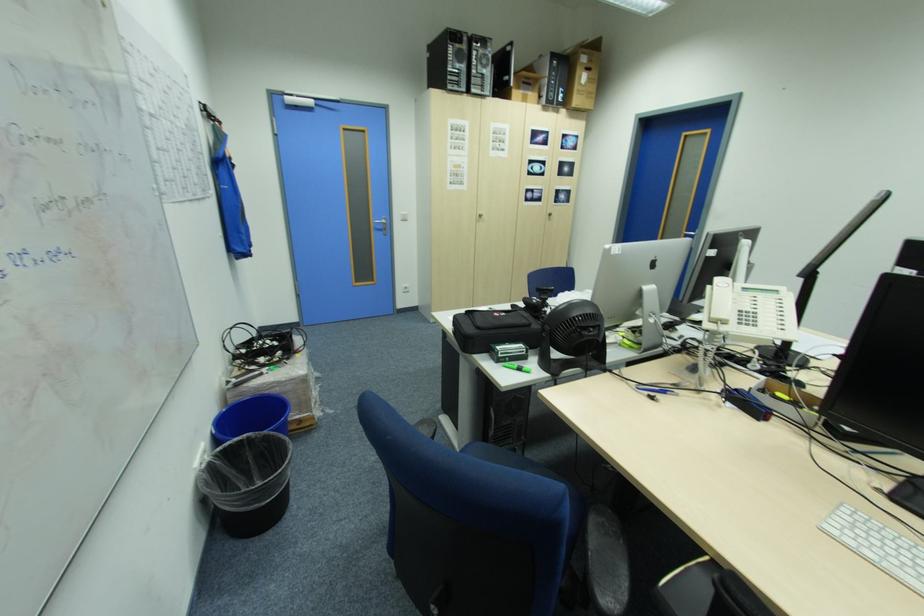
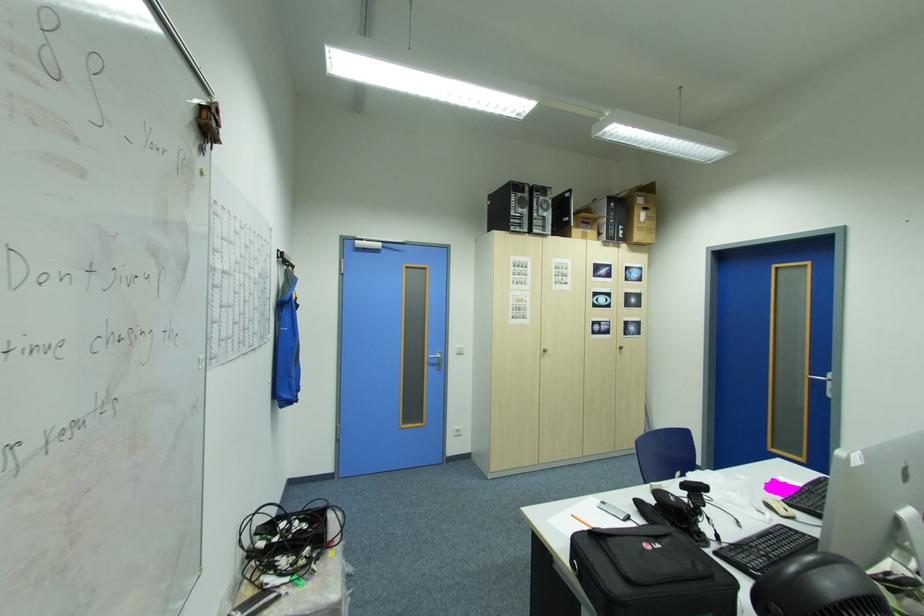
Where in the second image is the point corresponding to the point at 590,55 from the first image?

(648, 198)